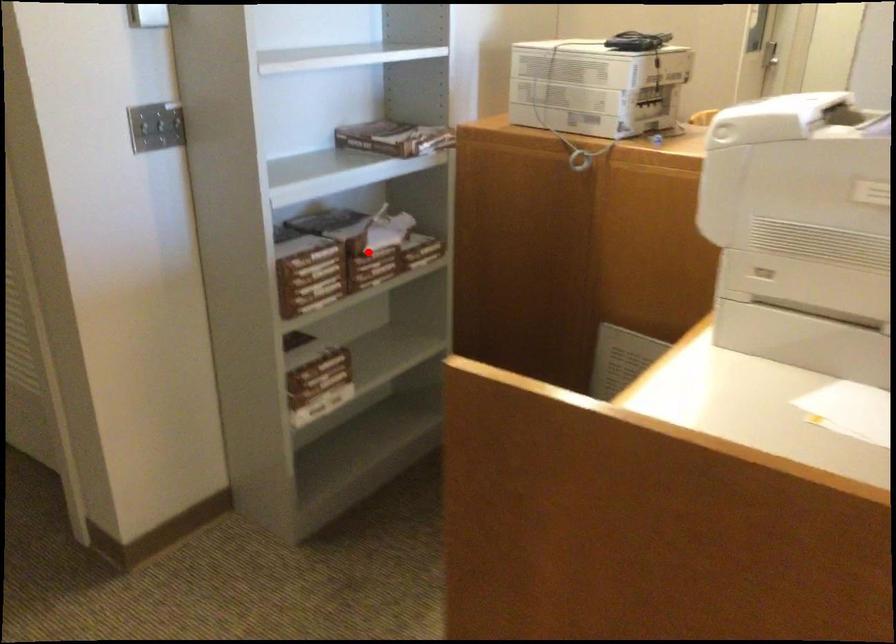
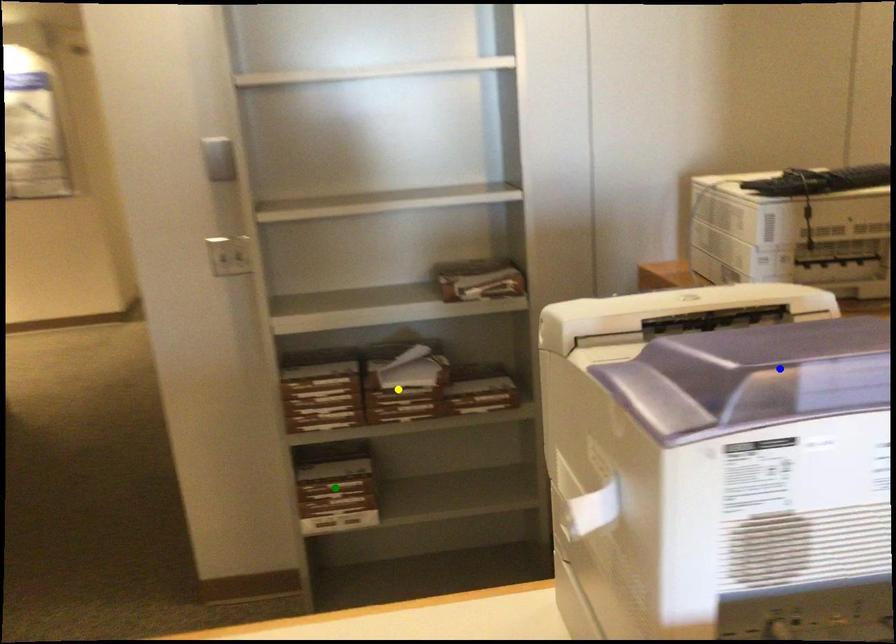
Question: I am providing you with two images of the same scene from different viewpoints. A red point is marked on the first image. You are given multiple points on the second image. Can you choose the point in image 2 that corresponds to the point in image 1?

Choices:
 (A) yellow point
 (B) blue point
 (C) green point

Answer: (A)